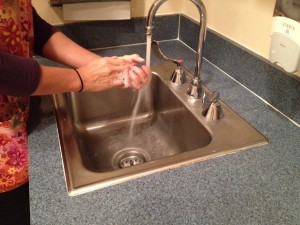
The width and height of the screenshot is (300, 225). Identify the location of counter. (207, 200).